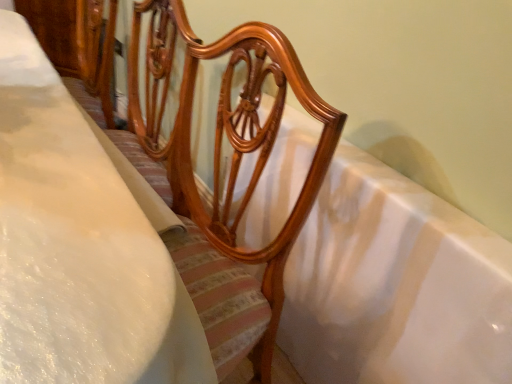
This screenshot has width=512, height=384. Describe the element at coordinates (81, 245) in the screenshot. I see `white soft bedsheet at center` at that location.

The height and width of the screenshot is (384, 512). I want to click on white soft bedsheet at center, so click(x=81, y=245).

The width and height of the screenshot is (512, 384). I want to click on white glossy bathtub at center, so click(395, 285).

What do you see at coordinates (395, 285) in the screenshot? I see `white glossy bathtub at center` at bounding box center [395, 285].

Locate an element on the screen. The height and width of the screenshot is (384, 512). white soft bedsheet at center is located at coordinates (81, 245).

Considering the relative positions of white glossy bathtub at center and white soft bedsheet at center in the image provided, is white glossy bathtub at center to the left of white soft bedsheet at center from the viewer's perspective?

In fact, white glossy bathtub at center is to the right of white soft bedsheet at center.

In the scene shown: Does white glossy bathtub at center lie in front of white soft bedsheet at center?

That is False.

Which point is more distant from viewer, (462, 336) or (73, 327)?

Point (462, 336)

From the image's perspective, relative to white soft bedsheet at center, is white glossy bathtub at center above or below?

white glossy bathtub at center is situated lower than white soft bedsheet at center in the image.

From a real-world perspective, does white glossy bathtub at center sit lower than white soft bedsheet at center?

Yes, from a real-world perspective, white glossy bathtub at center is beneath white soft bedsheet at center.

Considering the relative sizes of white glossy bathtub at center and white soft bedsheet at center in the image provided, is white glossy bathtub at center wider than white soft bedsheet at center?

No.

In terms of height, does white glossy bathtub at center look taller or shorter compared to white soft bedsheet at center?

Considering their sizes, white glossy bathtub at center has less height than white soft bedsheet at center.

Consider the image. Between white glossy bathtub at center and white soft bedsheet at center, which one has larger size?

white soft bedsheet at center is bigger.

Is white glossy bathtub at center outside of white soft bedsheet at center?

Yes, white glossy bathtub at center is located beyond the bounds of white soft bedsheet at center.

In the scene shown: Are white glossy bathtub at center and white soft bedsheet at center located far from each other?

They are positioned close to each other.

Could you tell me if white glossy bathtub at center is facing white soft bedsheet at center?

Yes, white glossy bathtub at center is aimed at white soft bedsheet at center.

From the picture: How different are the orientations of white glossy bathtub at center and white soft bedsheet at center in degrees?

7.76 degrees separate the facing orientations of white glossy bathtub at center and white soft bedsheet at center.

You are a GUI agent. You are given a task and a screenshot of the screen. Output one action in this format:
    pyautogui.click(x=<x>, y=<y>)
    Task: Click on the sheet located above the white glossy bathtub at center (from the image's perspective)
    
    Given the screenshot: What is the action you would take?
    pyautogui.click(x=81, y=245)

Does white soft bedsheet at center appear on the left side of white glossy bathtub at center?

Yes, white soft bedsheet at center is to the left of white glossy bathtub at center.

Considering their positions, is white soft bedsheet at center located in front of or behind white glossy bathtub at center?

In the image, white soft bedsheet at center appears in front of white glossy bathtub at center.

Considering the points (167, 298) and (310, 274), which point is in front, point (167, 298) or point (310, 274)?

Point (167, 298)

From the image's perspective, is white soft bedsheet at center located above or below white glossy bathtub at center?

Based on their image positions, white soft bedsheet at center is located above white glossy bathtub at center.

From a real-world perspective, relative to white glossy bathtub at center, is white soft bedsheet at center vertically above or below?

white soft bedsheet at center is above white glossy bathtub at center.

In terms of width, does white soft bedsheet at center look wider or thinner when compared to white glossy bathtub at center?

white soft bedsheet at center is wider than white glossy bathtub at center.

Is white soft bedsheet at center taller than white glossy bathtub at center?

Yes, white soft bedsheet at center is taller than white glossy bathtub at center.

Does white soft bedsheet at center have a smaller size compared to white glossy bathtub at center?

No, white soft bedsheet at center is not smaller than white glossy bathtub at center.

Is white soft bedsheet at center inside the boundaries of white glossy bathtub at center, or outside?

white soft bedsheet at center cannot be found inside white glossy bathtub at center.

Is white soft bedsheet at center far from white glossy bathtub at center?

No, white soft bedsheet at center is not far away from white glossy bathtub at center.

Could you tell me if white soft bedsheet at center is facing white glossy bathtub at center?

No, white soft bedsheet at center is not facing towards white glossy bathtub at center.

How many degrees apart are the facing directions of white soft bedsheet at center and white glossy bathtub at center?

white soft bedsheet at center and white glossy bathtub at center are facing 7.76 degrees away from each other.

This screenshot has height=384, width=512. What are the coordinates of `bath that appears behind the white soft bedsheet at center` in the screenshot? It's located at (395, 285).

Where is `sheet located in front of the white glossy bathtub at center`? The width and height of the screenshot is (512, 384). sheet located in front of the white glossy bathtub at center is located at coordinates (81, 245).

Where is `bath below the white soft bedsheet at center (from a real-world perspective)`? Image resolution: width=512 pixels, height=384 pixels. bath below the white soft bedsheet at center (from a real-world perspective) is located at coordinates (395, 285).